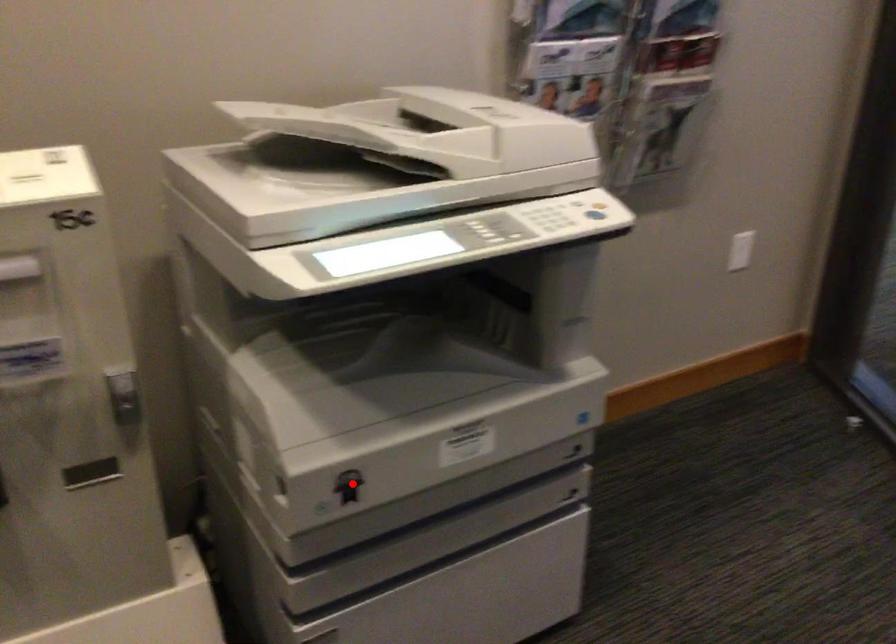
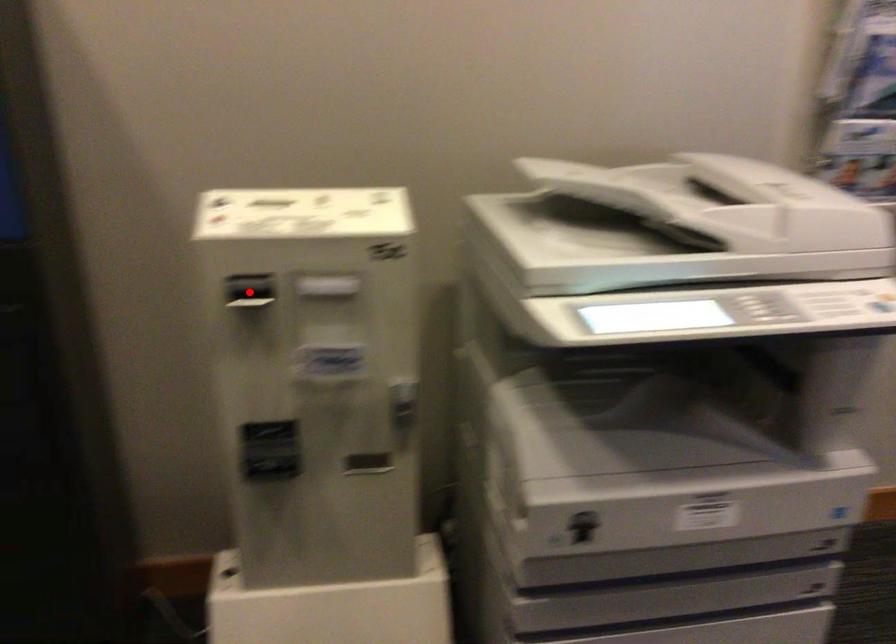
I am providing you with two images of the same scene from different viewpoints. A red point is marked on the first image and another point is marked on the second image. Do the highlighted points in image1 and image2 indicate the same real-world spot?

No